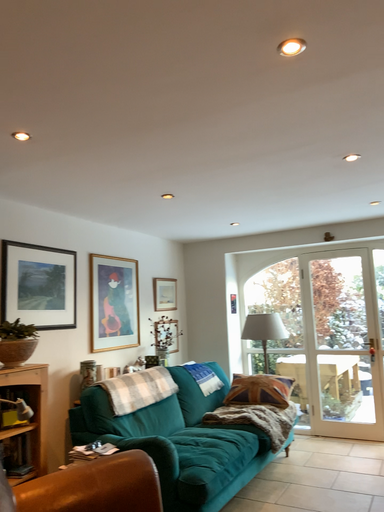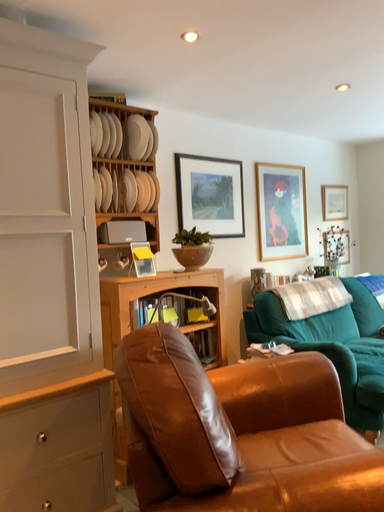
Question: Which way did the camera rotate in the video?

Choices:
 (A) rotated upward
 (B) rotated downward

Answer: (B)